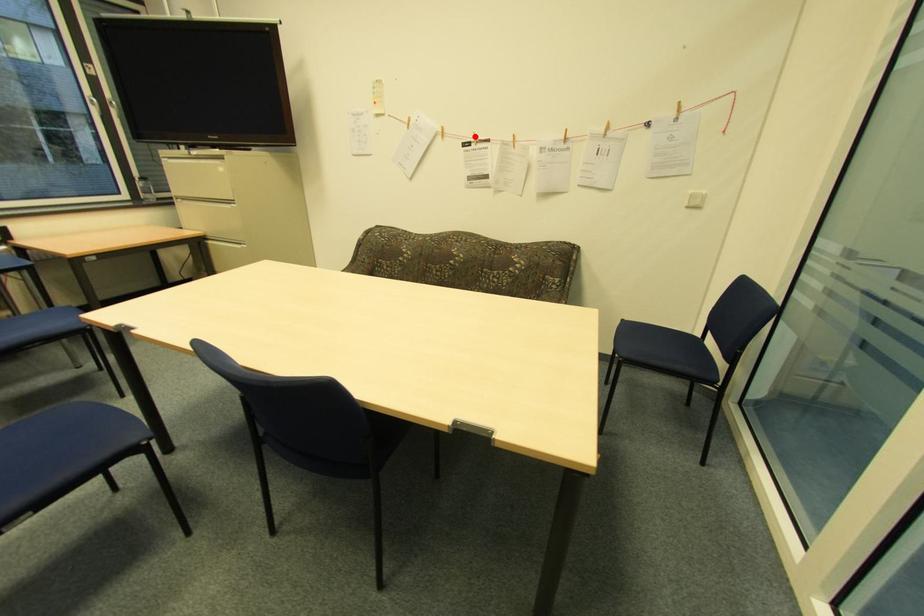
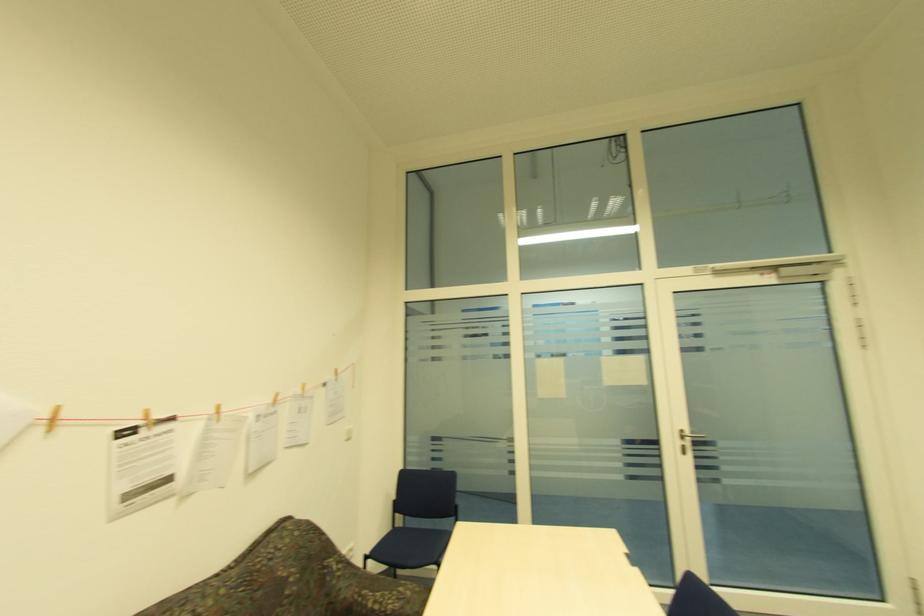
In the second image, find the point that corresponds to the highlighted location in the first image.

(141, 416)